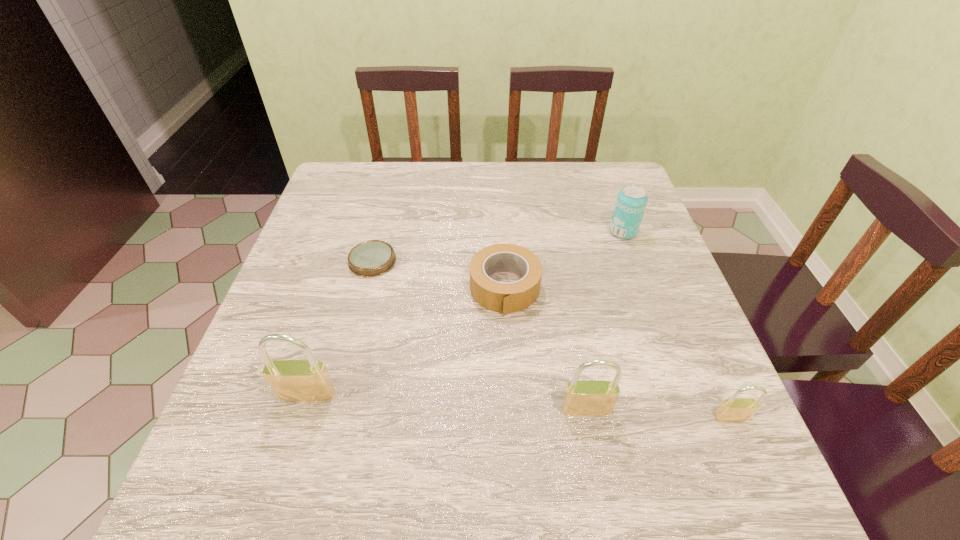
Find the location of a particular element. This screenshot has height=540, width=960. duct tape is located at coordinates (505, 298).

Locate an element on the screen. The width and height of the screenshot is (960, 540). vacant space located 0.340m on the right of the shortest object is located at coordinates (537, 261).

Where is `free point located on the front of the farthest object`? The image size is (960, 540). free point located on the front of the farthest object is located at coordinates pyautogui.click(x=674, y=373).

Locate an element on the screen. The height and width of the screenshot is (540, 960). free space located at the edge of the fifth tallest object is located at coordinates click(x=511, y=397).

Identify the location of padlock positioned at the left edge. The height and width of the screenshot is (540, 960). (308, 380).

Identify the location of compass situated at the left edge. The height and width of the screenshot is (540, 960). (371, 258).

Locate an element on the screen. Image resolution: width=960 pixels, height=540 pixels. padlock positioned at the right edge is located at coordinates (734, 409).

Where is `beer can present at the right edge`? This screenshot has height=540, width=960. beer can present at the right edge is located at coordinates (630, 205).

The height and width of the screenshot is (540, 960). Identify the location of object at the near left corner. (308, 380).

Find the location of a particular element. object that is at the near right corner is located at coordinates pos(734,409).